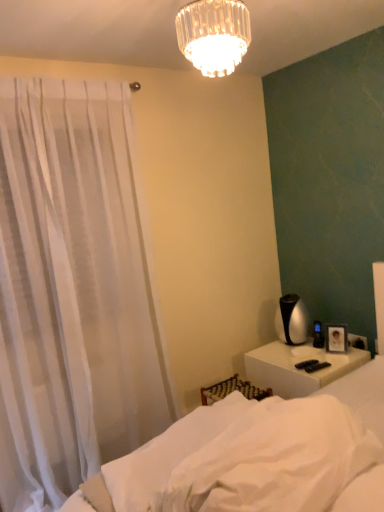
Describe the element at coordinates (297, 369) in the screenshot. This screenshot has height=512, width=384. I see `white glossy nightstand at lower right` at that location.

The height and width of the screenshot is (512, 384). What do you see at coordinates (257, 456) in the screenshot?
I see `white soft fabric bed at lower right` at bounding box center [257, 456].

Where is `white glossy nightstand at lower right`? This screenshot has width=384, height=512. white glossy nightstand at lower right is located at coordinates (297, 369).

From a real-world perspective, is white soft fabric at lower center, which is counted as the first sheet, starting from the back, located higher than white glossy nightstand at lower right?

Yes.

Does point (136, 501) come farther from viewer compared to point (283, 391)?

No, (136, 501) is in front of (283, 391).

At what (x,y) coordinates should I click in order to perform the action: click on lamp above the white soft fabric bed at lower right (from a real-world perspective). Please return your answer as a coordinate pair (x, y). This screenshot has height=512, width=384. Looking at the image, I should click on (214, 35).

From the image's perspective, would you say clear glass chandelier at upper center is positioned over white soft fabric bed at lower right?

Indeed, from the image's perspective, clear glass chandelier at upper center is shown above white soft fabric bed at lower right.

Looking at this image, from a real-world perspective, does clear glass chandelier at upper center sit lower than white soft fabric bed at lower right?

No, from a real-world perspective, clear glass chandelier at upper center is not under white soft fabric bed at lower right.

Measure the distance from clear glass chandelier at upper center to white soft fabric at lower center, the 1th sheet positioned from the front.

The distance of clear glass chandelier at upper center from white soft fabric at lower center, the 1th sheet positioned from the front, is 1.22 meters.

Which object is positioned more to the right, clear glass chandelier at upper center or white soft fabric at lower center, the second sheet when ordered from back to front?

white soft fabric at lower center, the second sheet when ordered from back to front, is more to the right.

Considering the sizes of objects clear glass chandelier at upper center and white soft fabric at lower center, the second sheet when ordered from back to front, in the image provided, who is taller, clear glass chandelier at upper center or white soft fabric at lower center, the second sheet when ordered from back to front,?

clear glass chandelier at upper center is taller.

Based on their sizes in the image, would you say clear glass chandelier at upper center is bigger or smaller than white soft fabric at lower center, the second sheet when ordered from back to front?

Considering their sizes, clear glass chandelier at upper center takes up less space than white soft fabric at lower center, the second sheet when ordered from back to front.

From a real-world perspective, between white sheer curtain at left and white soft fabric at lower center, which is counted as the first sheet, starting from the back, who is vertically higher?

From a 3D spatial view, white sheer curtain at left is above.

Is white sheer curtain at left in front of or behind white soft fabric at lower center, which is counted as the first sheet, starting from the back, in the image?

white sheer curtain at left is behind white soft fabric at lower center, which is counted as the first sheet, starting from the back.

Between white sheer curtain at left and white soft fabric at lower center, placed as the 2th sheet when sorted from front to back, which one appears on the right side from the viewer's perspective?

white soft fabric at lower center, placed as the 2th sheet when sorted from front to back, is more to the right.

Is white sheer curtain at left bigger than white soft fabric at lower center, placed as the 2th sheet when sorted from front to back?

Yes.

Which object is closer to the camera, white sheer curtain at left or white soft fabric at lower center, the 1th sheet positioned from the front?

white soft fabric at lower center, the 1th sheet positioned from the front.

Based on the photo, looking at their sizes, would you say white sheer curtain at left is wider or thinner than white soft fabric at lower center, the 1th sheet positioned from the front?

Clearly, white sheer curtain at left has less width compared to white soft fabric at lower center, the 1th sheet positioned from the front.

Based on the photo, could you measure the distance between white sheer curtain at left and white soft fabric at lower center, the 1th sheet positioned from the front?

white sheer curtain at left and white soft fabric at lower center, the 1th sheet positioned from the front, are 4.31 feet apart.

Consider the image. Which of these two, white sheer curtain at left or white soft fabric at lower center, the 1th sheet positioned from the front, is bigger?

Bigger between the two is white sheer curtain at left.

Is white soft fabric at lower center, which is counted as the first sheet, starting from the back, positioned with its back to white soft fabric bed at lower right?

That's right, white soft fabric at lower center, which is counted as the first sheet, starting from the back, is facing away from white soft fabric bed at lower right.

Relative to white soft fabric bed at lower right, is white soft fabric at lower center, placed as the 2th sheet when sorted from front to back, in front or behind?

Visually, white soft fabric at lower center, placed as the 2th sheet when sorted from front to back, is located behind white soft fabric bed at lower right.

Is white soft fabric at lower center, which is counted as the first sheet, starting from the back, inside or outside of white soft fabric bed at lower right?

white soft fabric at lower center, which is counted as the first sheet, starting from the back, is contained in white soft fabric bed at lower right.

Considering the relative sizes of white soft fabric at lower center, placed as the 2th sheet when sorted from front to back, and white soft fabric bed at lower right in the image provided, is white soft fabric at lower center, placed as the 2th sheet when sorted from front to back, wider than white soft fabric bed at lower right?

No, white soft fabric at lower center, placed as the 2th sheet when sorted from front to back, is not wider than white soft fabric bed at lower right.

Could you tell me if white soft fabric bed at lower right is facing white soft fabric at lower center, the 1th sheet positioned from the front?

Yes, white soft fabric bed at lower right faces towards white soft fabric at lower center, the 1th sheet positioned from the front.

Would you say white soft fabric bed at lower right is outside white soft fabric at lower center, the second sheet when ordered from back to front?

Absolutely, white soft fabric bed at lower right is external to white soft fabric at lower center, the second sheet when ordered from back to front.

Looking at this image, from the image's perspective, is white soft fabric bed at lower right over white soft fabric at lower center, the second sheet when ordered from back to front?

Indeed, from the image's perspective, white soft fabric bed at lower right is shown above white soft fabric at lower center, the second sheet when ordered from back to front.

At what (x,y) coordinates should I click in order to perform the action: click on nightstand below the white soft fabric at lower center, which is counted as the first sheet, starting from the back (from the image's perspective). Please return your answer as a coordinate pair (x, y). Looking at the image, I should click on (297, 369).

Locate an element on the screen. The height and width of the screenshot is (512, 384). lamp behind the white soft fabric bed at lower right is located at coordinates (214, 35).

Considering their positions, is white soft fabric at lower center, the second sheet when ordered from back to front, positioned further to white sheer curtain at left than white soft fabric at lower center, placed as the 2th sheet when sorted from front to back?

Among the two, white soft fabric at lower center, the second sheet when ordered from back to front, is located further to white sheer curtain at left.

Looking at the image, which one is located closer to white soft fabric bed at lower right, white glossy nightstand at lower right or white soft fabric at lower center, the 1th sheet positioned from the front?

The object closer to white soft fabric bed at lower right is white soft fabric at lower center, the 1th sheet positioned from the front.

Considering their positions, is clear glass chandelier at upper center positioned closer to white soft fabric at lower center, which is counted as the first sheet, starting from the back, than white soft fabric bed at lower right?

white soft fabric bed at lower right is closer to white soft fabric at lower center, which is counted as the first sheet, starting from the back.

Considering their positions, is white soft fabric bed at lower right positioned closer to white soft fabric at lower center, the 1th sheet positioned from the front, than white soft fabric at lower center, which is counted as the first sheet, starting from the back?

The object closer to white soft fabric at lower center, the 1th sheet positioned from the front, is white soft fabric bed at lower right.

Based on the photo, considering their positions, is white soft fabric at lower center, placed as the 2th sheet when sorted from front to back, positioned closer to white sheer curtain at left than white soft fabric bed at lower right?

white soft fabric at lower center, placed as the 2th sheet when sorted from front to back.

From the image, which object appears to be nearer to clear glass chandelier at upper center, white sheer curtain at left or white soft fabric at lower center, the 1th sheet positioned from the front?

The object closer to clear glass chandelier at upper center is white soft fabric at lower center, the 1th sheet positioned from the front.

When comparing their distances from white soft fabric at lower center, the second sheet when ordered from back to front, does clear glass chandelier at upper center or white soft fabric bed at lower right seem closer?

white soft fabric bed at lower right is positioned closer to the anchor white soft fabric at lower center, the second sheet when ordered from back to front.

Based on their spatial positions, is clear glass chandelier at upper center or white sheer curtain at left further from white glossy nightstand at lower right?

clear glass chandelier at upper center lies further to white glossy nightstand at lower right than the other object.

Find the location of a particular element. sheet between white soft fabric at lower center, the second sheet when ordered from back to front, and white glossy nightstand at lower right, along the z-axis is located at coordinates (161, 458).

At what (x,y) coordinates should I click in order to perform the action: click on bed that lies between clear glass chandelier at upper center and white soft fabric at lower center, the 1th sheet positioned from the front, from top to bottom. Please return your answer as a coordinate pair (x, y). Looking at the image, I should click on (257, 456).

Find the location of `curtain between clear glass chandelier at upper center and white soft fabric bed at lower right from top to bottom`. curtain between clear glass chandelier at upper center and white soft fabric bed at lower right from top to bottom is located at coordinates (73, 291).

Locate an element on the screen. The height and width of the screenshot is (512, 384). bed that lies between clear glass chandelier at upper center and white soft fabric at lower center, placed as the 2th sheet when sorted from front to back, from top to bottom is located at coordinates (257, 456).